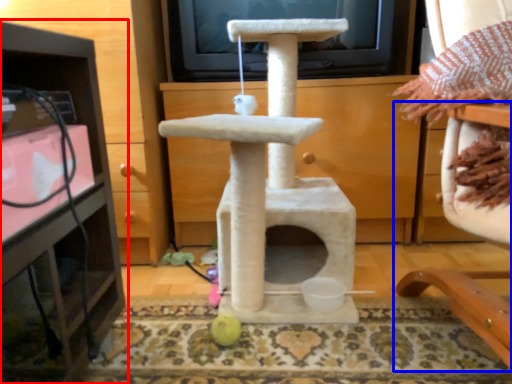
Question: Which of the following is the farthest to the observer, furniture (highlighted by a red box) or furniture (highlighted by a blue box)?

Choices:
 (A) furniture
 (B) furniture

Answer: (A)